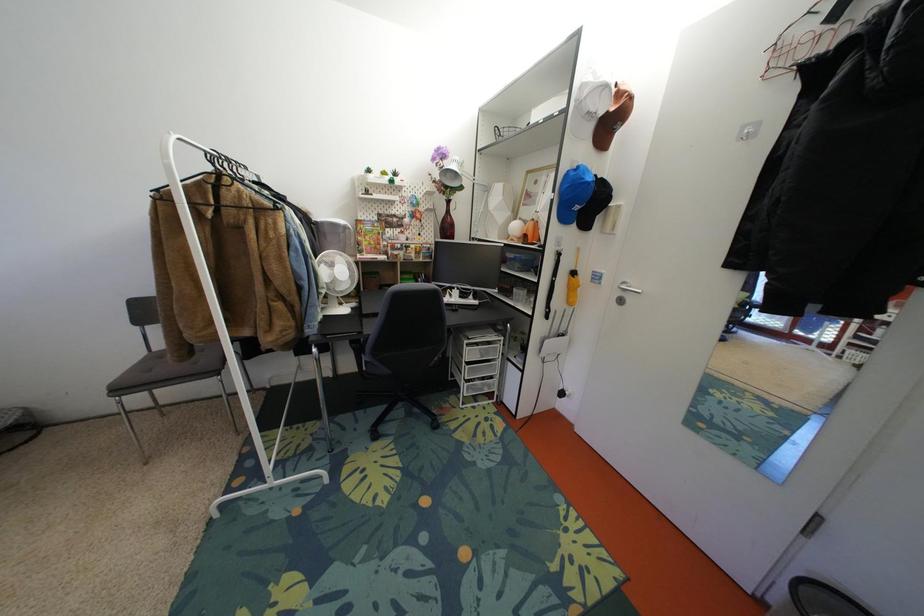
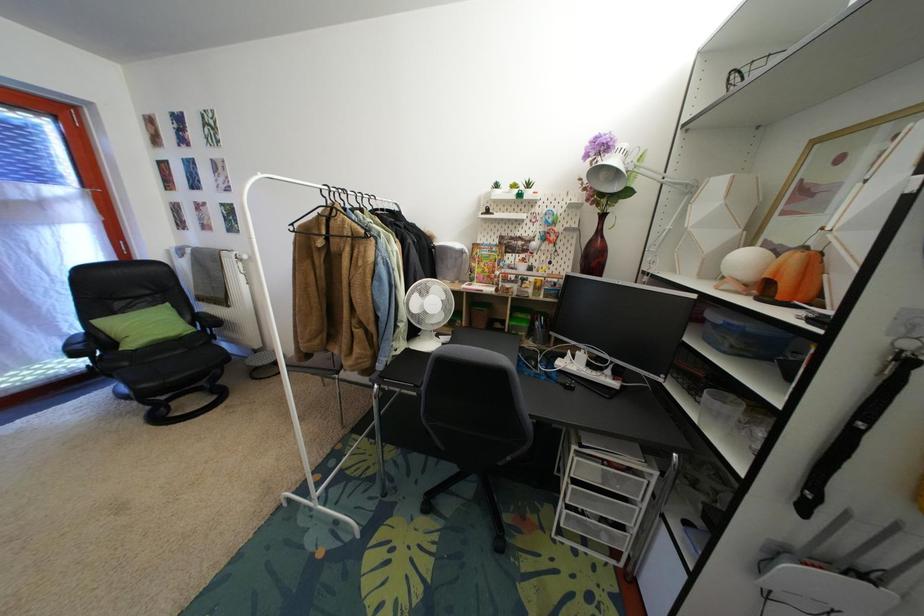
Question: The camera is either moving clockwise (left) or counter-clockwise (right) around the object. The first image is from the beginning of the video and the second image is from the end. Is the camera moving left or right when shooting the video?

Choices:
 (A) Left
 (B) Right

Answer: (B)